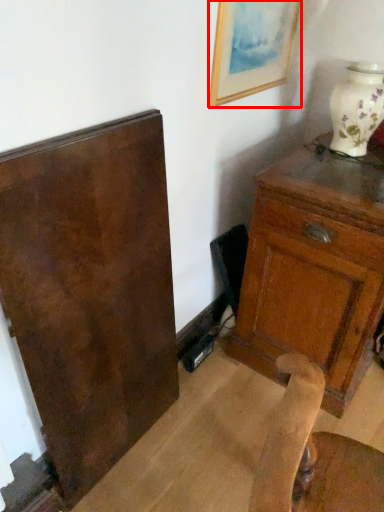
Question: From the image's perspective, where is picture frame (annotated by the red box) located relative to chest of drawers?

Choices:
 (A) below
 (B) above

Answer: (B)